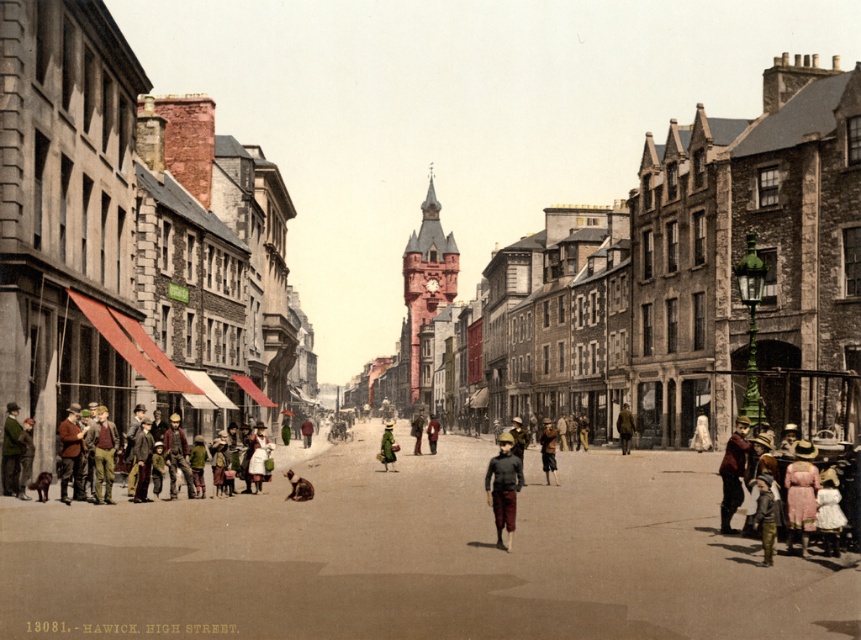
Question: Which of these objects is positioned farthest from the brown wool coat at left?

Choices:
 (A) brown leather jacket at center
 (B) dark brown leather jacket at lower right
 (C) light brown fabric dress at center

Answer: (A)

Question: Does brown wool coat at center have a greater width compared to khaki fabric jacket at center?

Choices:
 (A) no
 (B) yes

Answer: (B)

Question: Which object appears farthest from the camera in this image?

Choices:
 (A) matte stone buildings at left
 (B) light brown fur dog at center
 (C) matte brown pants at center
 (D) brown wool coat at center

Answer: (B)

Question: Considering the real-world distances, which object is farthest from the light brown fur dog at center?

Choices:
 (A) light brown fabric dress at center
 (B) green fabric coat at center
 (C) brown wool coat at center
 (D) brown wool coat at left

Answer: (D)

Question: Can you confirm if matte stone buildings at left is positioned above brown wool coat at center?

Choices:
 (A) yes
 (B) no

Answer: (A)

Question: Is dark brown leather jacket at lower right bigger than green fabric coat at center?

Choices:
 (A) yes
 (B) no

Answer: (A)